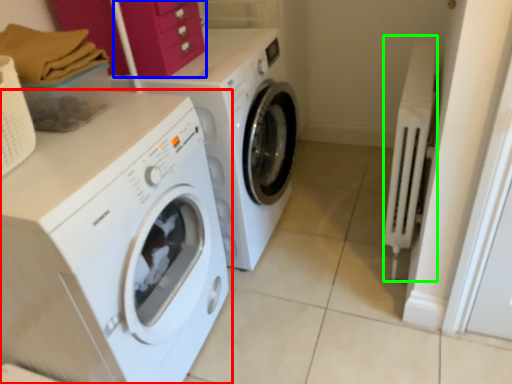
Question: Considering the real-world distances, which object is farthest from washing machine (highlighted by a red box)? drawer (highlighted by a blue box) or radiator (highlighted by a green box)?

Choices:
 (A) drawer
 (B) radiator

Answer: (B)